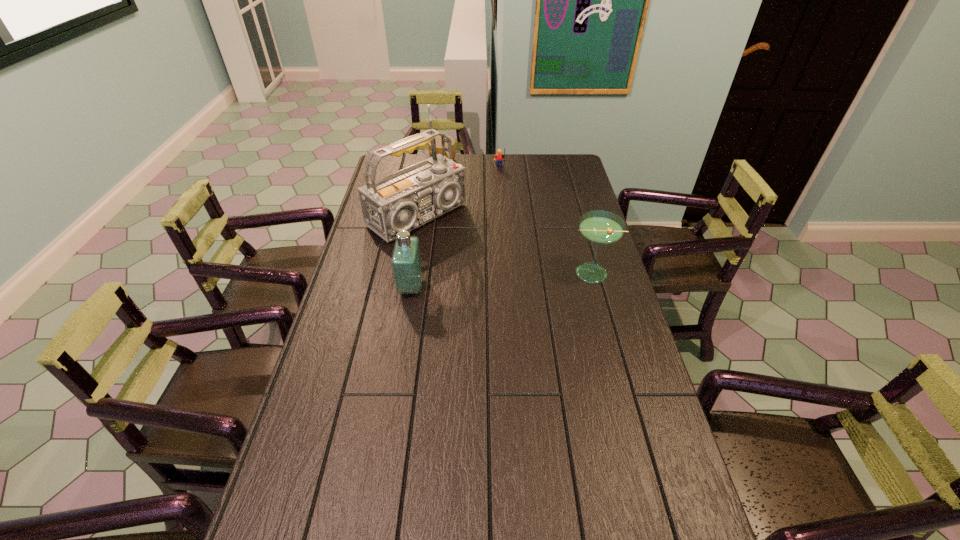
This screenshot has width=960, height=540. What are the coordinates of `perfume` in the screenshot? It's located at (406, 261).

Find the location of a particular element. martini is located at coordinates (599, 227).

You are a GUI agent. You are given a task and a screenshot of the screen. Output one action in this format:
    pyautogui.click(x=<x>, y=<y>)
    Task: Click on the radio receiver
    
    Given the screenshot: What is the action you would take?
    pyautogui.click(x=407, y=199)

At what (x,y) coordinates should I click in order to perform the action: click on the third nearest object. Please return your answer as a coordinate pair (x, y). This screenshot has height=540, width=960. Looking at the image, I should click on (407, 199).

You are a GUI agent. You are given a task and a screenshot of the screen. Output one action in this format:
    pyautogui.click(x=<x>, y=<y>)
    Task: Click on the Lego
    
    Given the screenshot: What is the action you would take?
    pyautogui.click(x=499, y=157)

Where is `the shortest object`? This screenshot has width=960, height=540. the shortest object is located at coordinates (438, 138).

Identify the location of vacant region located on the front label of the perfume. The image size is (960, 540). (345, 287).

This screenshot has width=960, height=540. Identify the location of free space located on the front label of the perfume. (357, 287).

This screenshot has height=540, width=960. In order to click on vacant space located 0.100m on the front label of the perfume in this screenshot , I will do `click(369, 287)`.

You are a GUI agent. You are given a task and a screenshot of the screen. Output one action in this format:
    pyautogui.click(x=<x>, y=<y>)
    Task: Click on the free space located on the left of the rightmost object
    Image resolution: width=960 pixels, height=540 pixels.
    Given the screenshot: What is the action you would take?
    pyautogui.click(x=458, y=273)